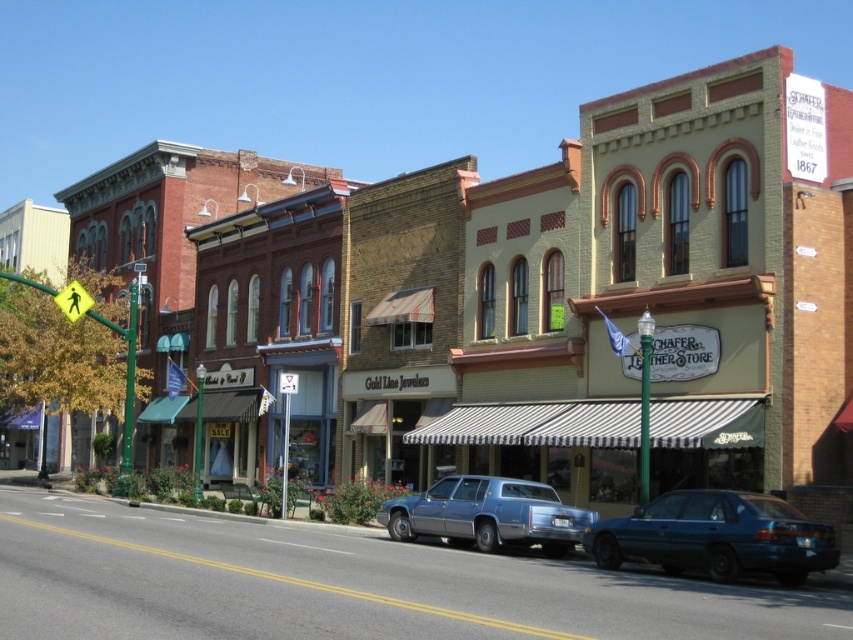
Question: Is the position of teal metallic sedan at center more distant than that of metallic blue sedan at center?

Choices:
 (A) no
 (B) yes

Answer: (A)

Question: Is teal metallic sedan at center smaller than metallic blue sedan at center?

Choices:
 (A) no
 (B) yes

Answer: (A)

Question: Can you confirm if teal metallic sedan at center is smaller than metallic blue sedan at center?

Choices:
 (A) no
 (B) yes

Answer: (A)

Question: Which point appears closest to the camera in this image?

Choices:
 (A) (486, 508)
 (B) (793, 538)

Answer: (B)

Question: Which point is closer to the camera taking this photo?

Choices:
 (A) (479, 481)
 (B) (730, 531)

Answer: (B)